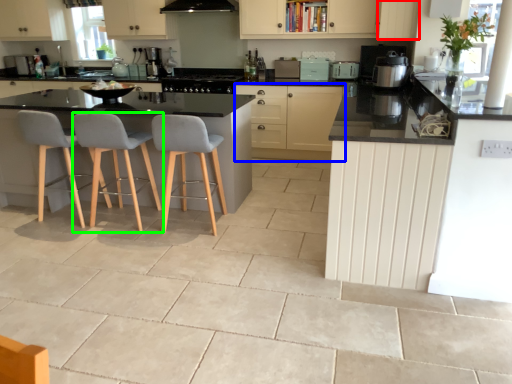
Question: Which object is positioned closest to cabinetry (highlighted by a red box)? Select from cabinetry (highlighted by a blue box) and chair (highlighted by a green box).

Choices:
 (A) cabinetry
 (B) chair

Answer: (A)